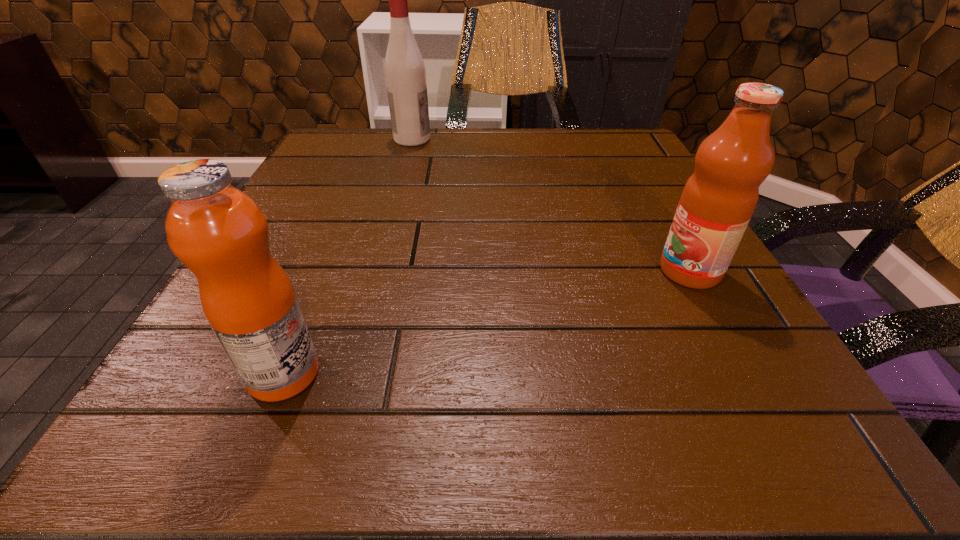
You are a GUI agent. You are given a task and a screenshot of the screen. Output one action in this format:
    pyautogui.click(x=<x>, y=<y>)
    Task: Click on the vacant space located on the back of the left fruit juice
    The height and width of the screenshot is (540, 960).
    Given the screenshot: What is the action you would take?
    pyautogui.click(x=359, y=188)

Find the location of a particular element. object located at the far edge is located at coordinates (405, 74).

Find the location of a particular element. This screenshot has width=960, height=540. object present at the near edge is located at coordinates (218, 232).

Find the location of a particular element. This screenshot has width=960, height=540. alcohol present at the left edge is located at coordinates (405, 74).

Locate an element on the screen. fruit juice positioned at the left edge is located at coordinates (218, 232).

Locate an element on the screen. Image resolution: width=960 pixels, height=540 pixels. object at the right edge is located at coordinates (719, 198).

Identify the location of object that is at the far left corner. (405, 74).

Locate an element on the screen. object that is at the near left corner is located at coordinates (218, 232).

The width and height of the screenshot is (960, 540). Find the location of `vacant space at the far edge of the desktop`. vacant space at the far edge of the desktop is located at coordinates (435, 176).

Find the location of `blank space at the near edge`. blank space at the near edge is located at coordinates (404, 460).